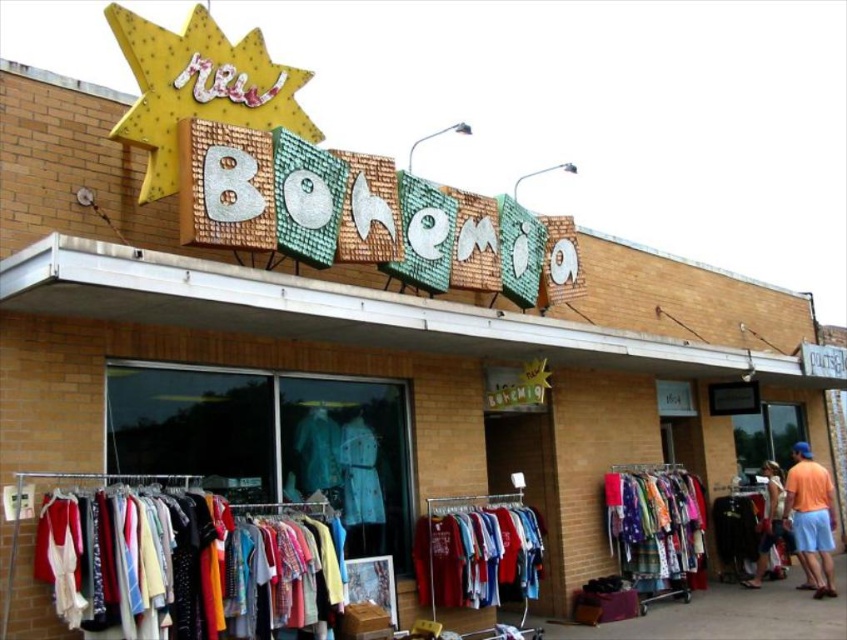
Based on the photo, can you confirm if multicolored fabric shirts at center is positioned to the left of teal fabric dress at center?

No, multicolored fabric shirts at center is not to the left of teal fabric dress at center.

Between multicolored fabric shirts at center and teal fabric dress at center, which one is positioned lower?

Positioned lower is multicolored fabric shirts at center.

Who is more forward, (535, 570) or (320, 412)?

Point (320, 412) is more forward.

I want to click on multicolored fabric shirts at center, so click(477, 556).

Where is `multicolored fabric shirts at center`? multicolored fabric shirts at center is located at coordinates (477, 556).

Who is more forward, (441, 580) or (768, 488)?

Point (441, 580) is more forward.

Find the location of a particular element. This screenshot has width=847, height=640. multicolored fabric shirts at center is located at coordinates (477, 556).

The width and height of the screenshot is (847, 640). What do you see at coordinates (811, 516) in the screenshot?
I see `orange cotton t-shirt at right` at bounding box center [811, 516].

Is orange cotton t-shirt at right below teal fabric dress at center?

Indeed, orange cotton t-shirt at right is positioned under teal fabric dress at center.

Identify the location of orange cotton t-shirt at right. Image resolution: width=847 pixels, height=640 pixels. (811, 516).

Image resolution: width=847 pixels, height=640 pixels. What are the coordinates of `orange cotton t-shirt at right` in the screenshot? It's located at (x=811, y=516).